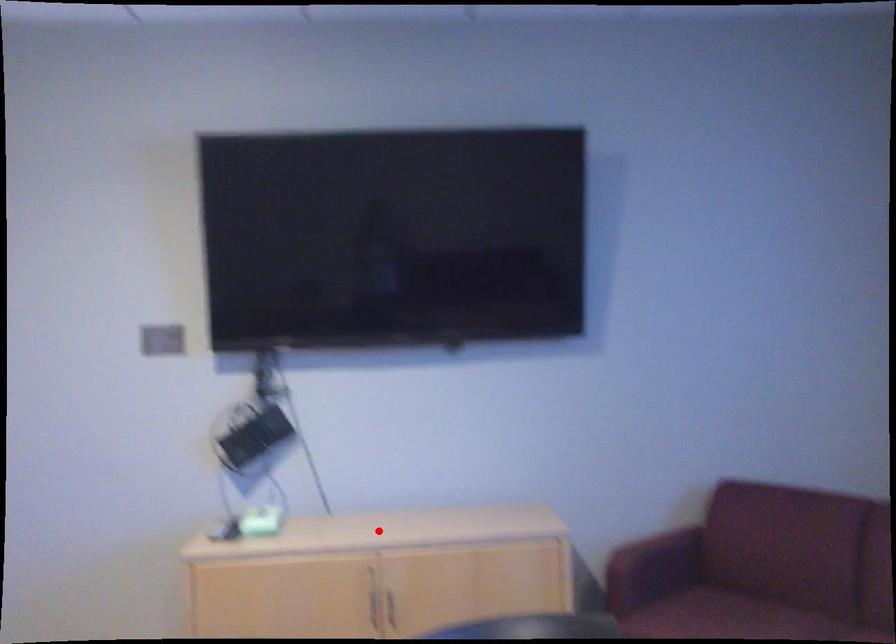
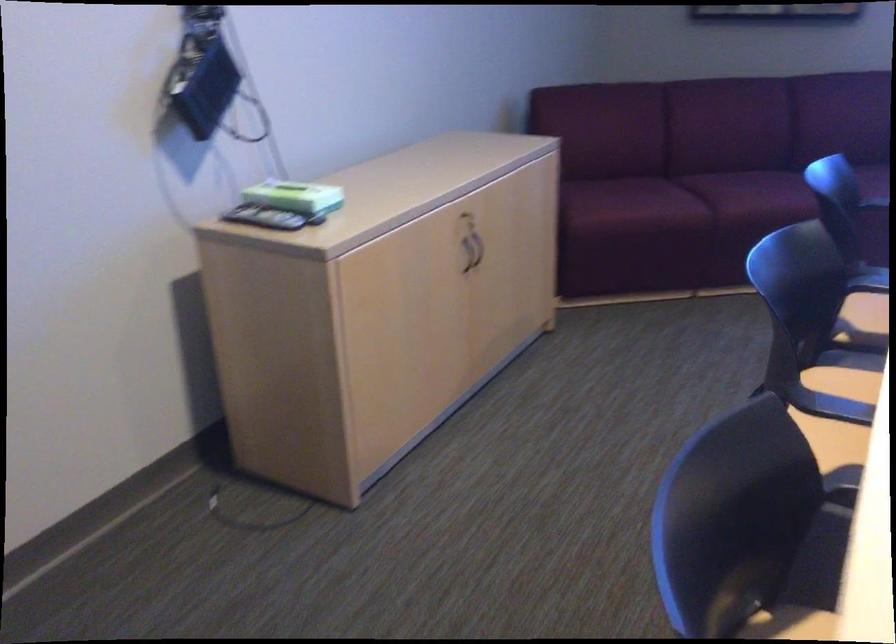
Question: I am providing you with two images of the same scene from different viewpoints. Given a red point in image1, look at the same physical point in image2. Is it:

Choices:
 (A) Closer to the viewpoint
 (B) Farther from the viewpoint

Answer: (A)